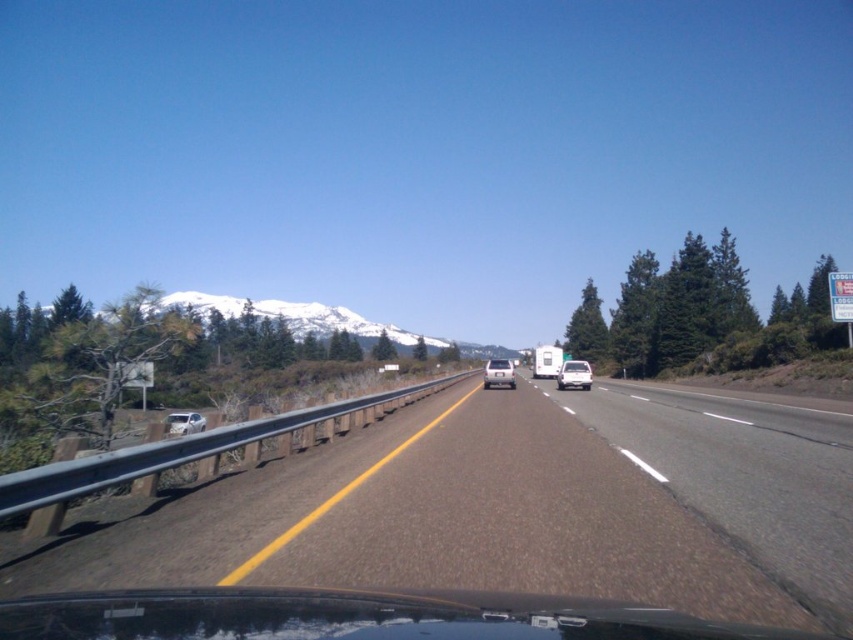
Question: Among these objects, which one is nearest to the camera?

Choices:
 (A) white matte truck at center
 (B) asphalt road at center
 (C) satin silver sedan at left
 (D) silver metallic car at center

Answer: (B)

Question: Which object is farther from the camera taking this photo?

Choices:
 (A) white matte truck at center
 (B) silver metallic car at center
 (C) asphalt road at center

Answer: (A)

Question: Is the position of asphalt road at center less distant than that of satin silver sedan at left?

Choices:
 (A) no
 (B) yes

Answer: (B)

Question: Can you confirm if silver metallic car at center is positioned to the right of satin silver sedan at left?

Choices:
 (A) no
 (B) yes

Answer: (B)

Question: Estimate the real-world distances between objects in this image. Which object is closer to the white matte truck at center?

Choices:
 (A) satin silver sedan at left
 (B) white matte van at center
 (C) asphalt road at center
 (D) silver metallic car at center

Answer: (D)

Question: Can you confirm if asphalt road at center is wider than satin silver sedan at left?

Choices:
 (A) no
 (B) yes

Answer: (A)